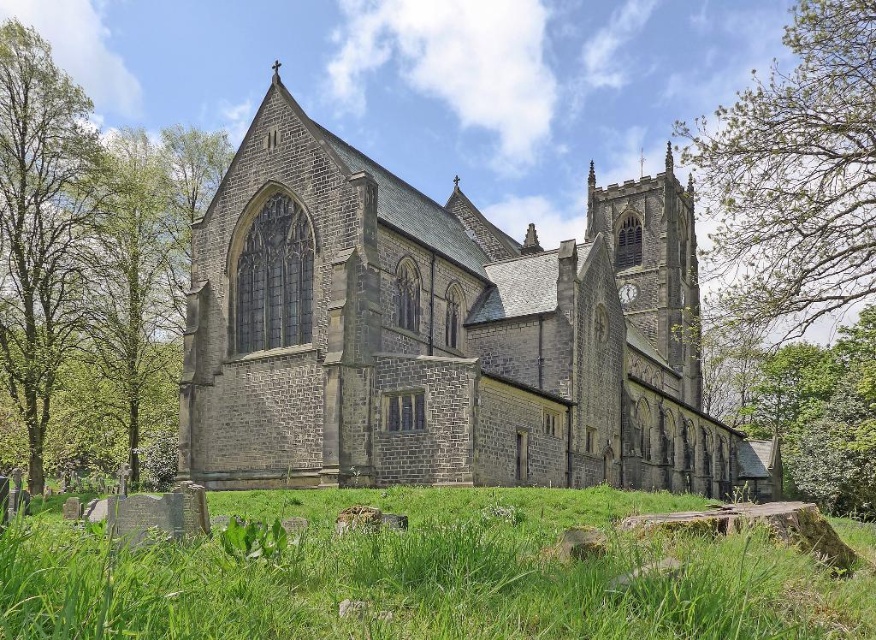
You are standing in front of the church and want to take a photo of the green grass at lower center and the green leafy tree at left. Which object is closer to the camera?

The green grass at lower center is closer to the camera because it is positioned below the green leafy tree at left, indicating it is in the foreground.

In the scene shown: You are standing in front of the church and notice the green grass at lower center and the green leafy branches at upper right. Which of these two objects is closer to the ground?

The green grass at lower center is closer to the ground because it is positioned under the green leafy branches at upper right.

You are a photographer planning to take a wide shot of the church. You want to include both the green grass at lower center and the green leafy tree at left in the frame. Which object will appear bigger in the photo?

The green grass at lower center will appear bigger in the photo because it is larger in size than the green leafy tree at left.